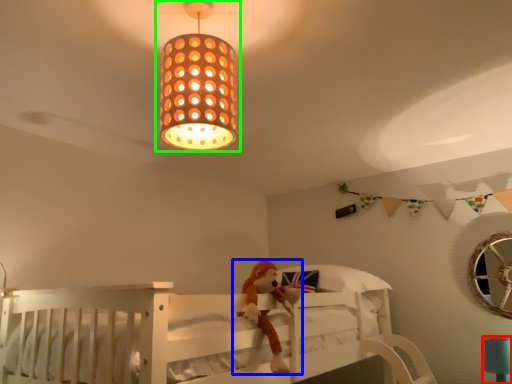
Question: Which object is the farthest from table lamp (highlighted by a red box)? Choose among these: toy (highlighted by a blue box) or lamp (highlighted by a green box).

Choices:
 (A) toy
 (B) lamp

Answer: (B)